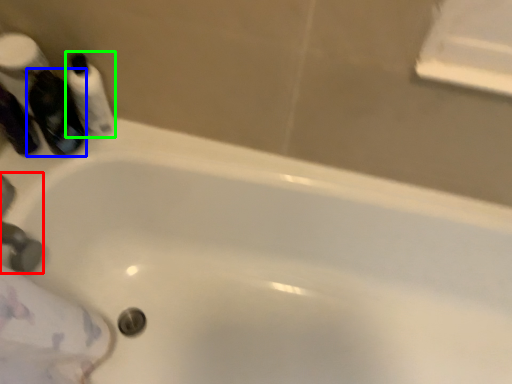
Question: Estimate the real-world distances between objects in this image. Which object is closer to faucet (highlighted by a red box), mouthwash (highlighted by a blue box) or mouthwash (highlighted by a green box)?

Choices:
 (A) mouthwash
 (B) mouthwash

Answer: (A)